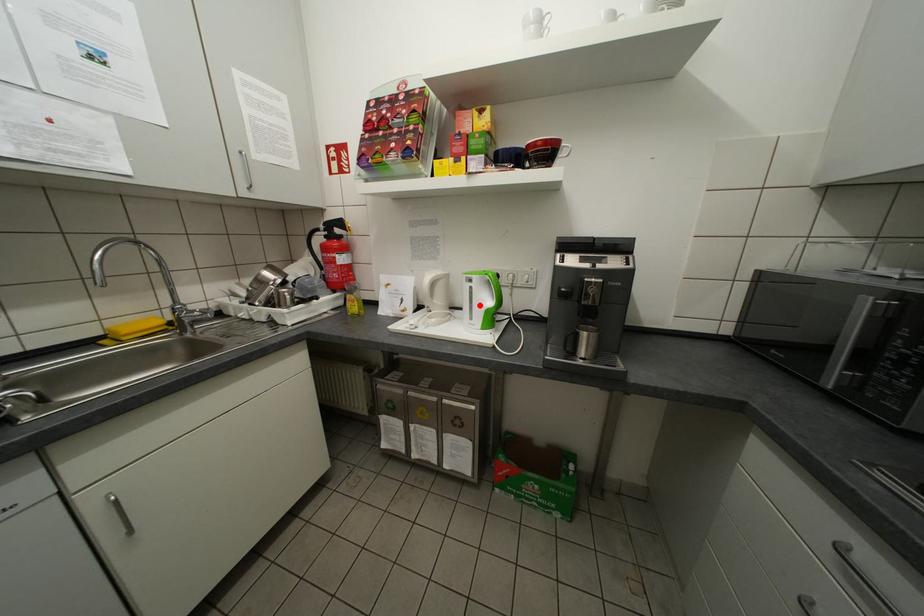
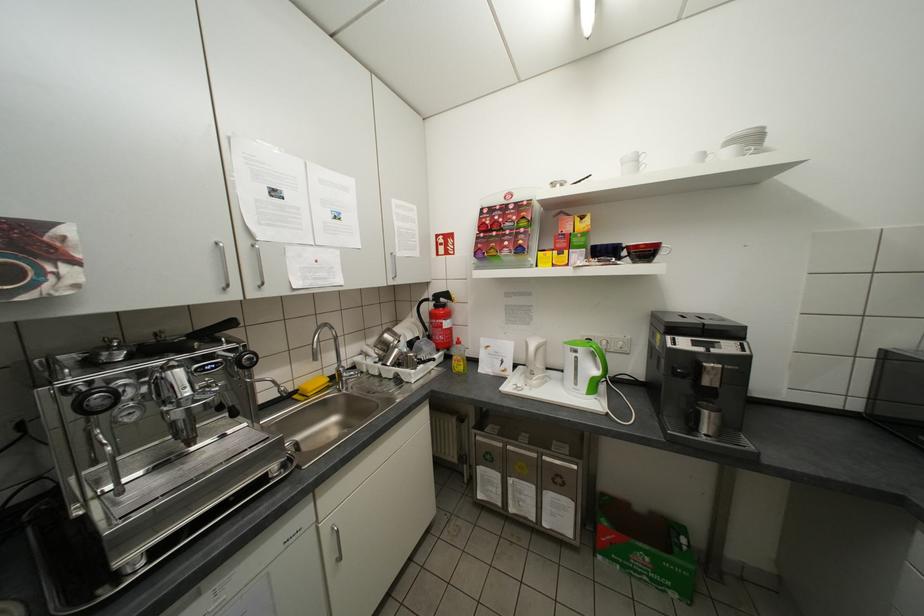
Where in the second image is the point corresponding to the highlighted location from the first image?

(585, 373)